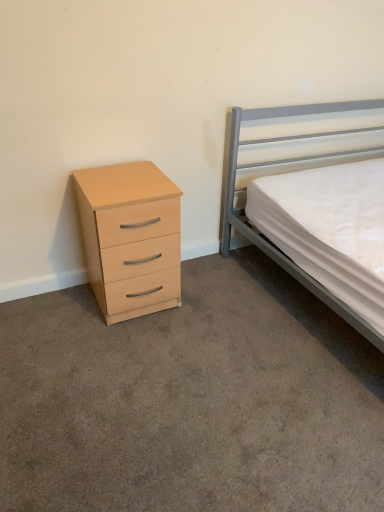
Find the location of a particular element. The image size is (384, 512). blank space situated above matte wood chest of drawers at left (from a real-world perspective) is located at coordinates (130, 170).